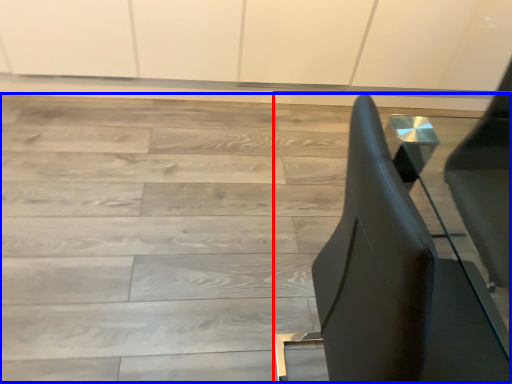
Question: Which of the following is the farthest to the observer, furniture (highlighted by a red box) or stairwell (highlighted by a blue box)?

Choices:
 (A) furniture
 (B) stairwell

Answer: (B)